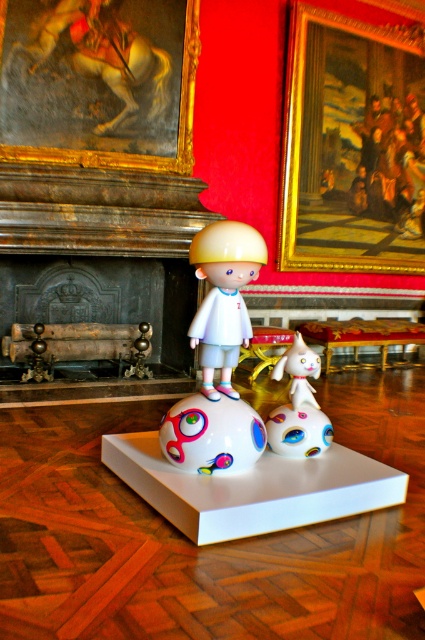
You are an interior designer planning to place a new artwork exactly at coordinate point 0.5, 0.5. Will the new artwork overlap with the matte white doll at center?

The matte white doll at center is positioned at point [223,298], which is very close to the desired coordinate [212,320]. Depending on the size of the new artwork, there might be an overlap. However, since the exact dimensions are not provided, it is recommended to check the artwork size before placement.

You are an interior designer planning to place a new lamp in the scene. The lamp has a base that requires a clear space of 1 meter in diameter. Given the current layout, is there enough space around the matte white ball at center to accommodate the lamp base without overlapping any objects?

The matte white ball at center is located at point coordinates, but without specific spatial dimensions or distances between objects provided in the scene description, it is impossible to determine if there is sufficient space for the lamp base. Further measurements or details about object spacing are needed to answer this accurately.

You are an art curator planning to move the matte white ball at center and the multicolored glossy ball at center to a new exhibition space. If you want to place them side by side on a shelf, which ball should be placed first to maintain their original spatial relationship?

The matte white ball at center should be placed first since it was originally in front of the multicolored glossy ball at center. To maintain the spatial relationship, the matte white ball should be positioned closer to the front of the shelf, with the multicolored glossy ball placed behind it.